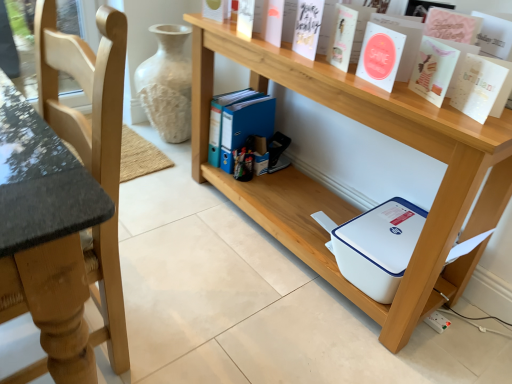
At what (x,y) coordinates should I click in order to perform the action: click on vacant space in front of white matte vase at center. Please return your answer as a coordinate pair (x, y). Looking at the image, I should click on (158, 163).